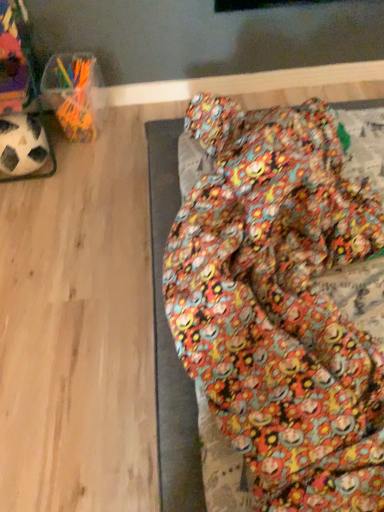
The width and height of the screenshot is (384, 512). Find the location of `vacant area on top of black matte soccer ball at left (from a real-world perspective)`. vacant area on top of black matte soccer ball at left (from a real-world perspective) is located at coordinates (18, 122).